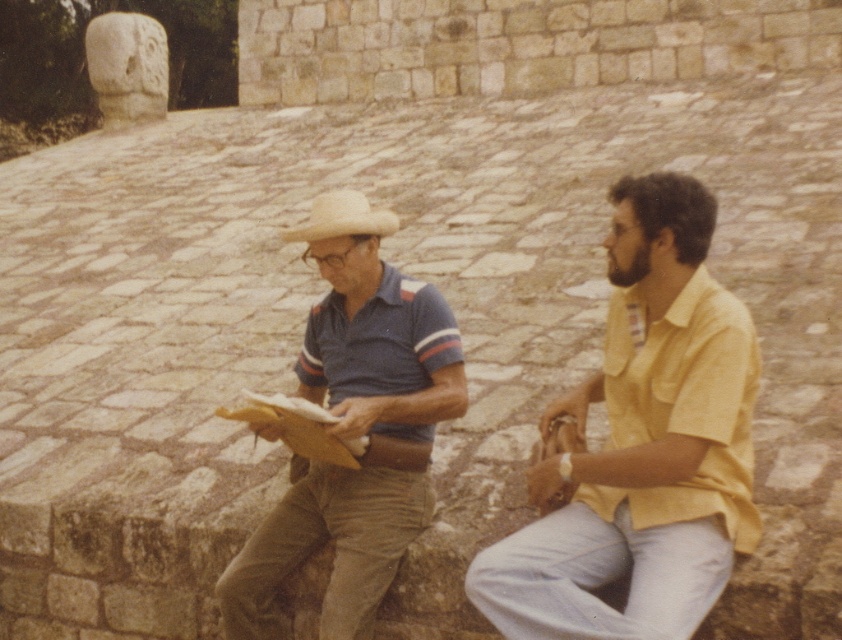
Is yellow cotton shirt at right positioned in front of blue striped polo shirt at center?

Yes, yellow cotton shirt at right is in front of blue striped polo shirt at center.

Is yellow cotton shirt at right smaller than blue striped polo shirt at center?

Actually, yellow cotton shirt at right might be larger than blue striped polo shirt at center.

Between point (637, 465) and point (398, 472), which one is positioned behind?

Point (398, 472)

The width and height of the screenshot is (842, 640). Find the location of `yellow cotton shirt at right`. yellow cotton shirt at right is located at coordinates (642, 444).

Does blue striped polo shirt at center have a lesser width compared to strawmaterial/texturecowboy hat at center?

Indeed, blue striped polo shirt at center has a lesser width compared to strawmaterial/texturecowboy hat at center.

Looking at this image, who is shorter, blue striped polo shirt at center or strawmaterial/texturecowboy hat at center?

blue striped polo shirt at center

At what (x,y) coordinates should I click in order to perform the action: click on blue striped polo shirt at center. Please return your answer as a coordinate pair (x, y). This screenshot has height=640, width=842. Looking at the image, I should click on (354, 428).

At what (x,y) coordinates should I click in order to perform the action: click on blue striped polo shirt at center. Please return your answer as a coordinate pair (x, y). The image size is (842, 640). Looking at the image, I should click on (354, 428).

Who is positioned more to the right, yellow cotton shirt at right or strawmaterial/texturecowboy hat at center?

Positioned to the right is yellow cotton shirt at right.

Is yellow cotton shirt at right wider than strawmaterial/texturecowboy hat at center?

No, yellow cotton shirt at right is not wider than strawmaterial/texturecowboy hat at center.

Identify the location of yellow cotton shirt at right. This screenshot has width=842, height=640. (642, 444).